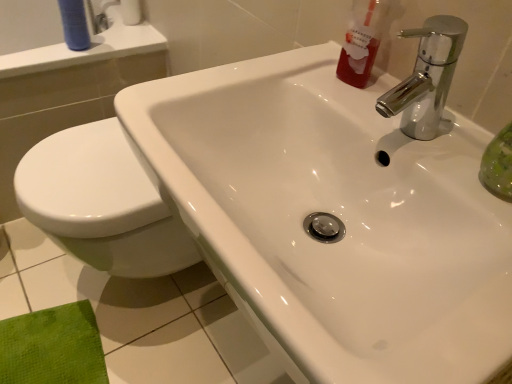
Locate an element on the screen. This screenshot has height=384, width=512. vacant area in front of translucent red liquid at upper right is located at coordinates (387, 123).